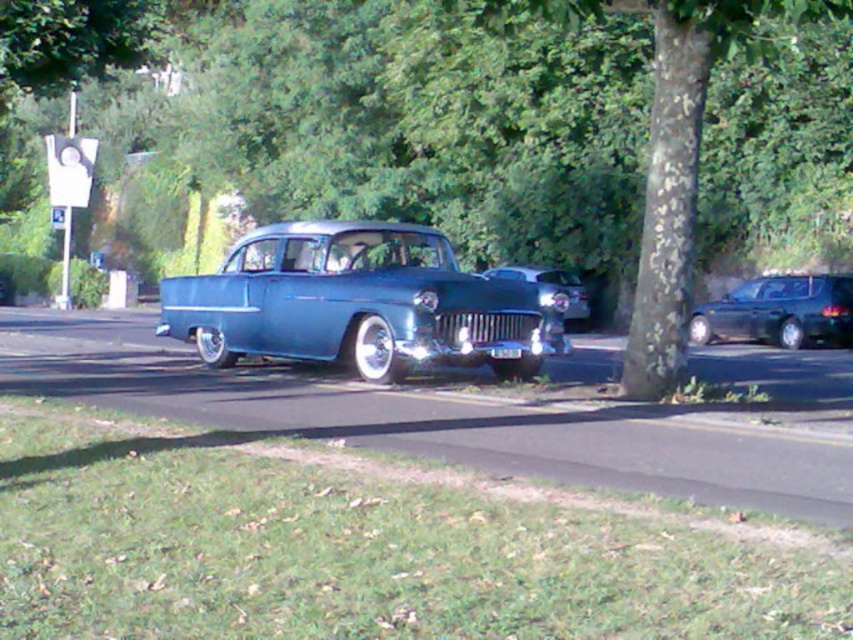
Question: Which point is farther to the camera?

Choices:
 (A) white plastic license plate at center
 (B) metallic blue pickup truck at center

Answer: (A)

Question: Based on their relative distances, which object is farther from the white plastic license plate at center?

Choices:
 (A) shiny chrome car at center
 (B) metallic blue pickup truck at center
 (C) shiny black sedan at right

Answer: (C)

Question: Is metallic blue pickup truck at center to the right of shiny black sedan at right from the viewer's perspective?

Choices:
 (A) no
 (B) yes

Answer: (A)

Question: Does shiny black sedan at right appear on the right side of white plastic license plate at center?

Choices:
 (A) yes
 (B) no

Answer: (A)

Question: Considering the real-world distances, which object is farthest from the shiny chrome car at center?

Choices:
 (A) white plastic license plate at center
 (B) shiny black sedan at right
 (C) metallic blue pickup truck at center

Answer: (B)

Question: Does metallic blue pickup truck at center lie in front of shiny chrome car at center?

Choices:
 (A) no
 (B) yes

Answer: (B)